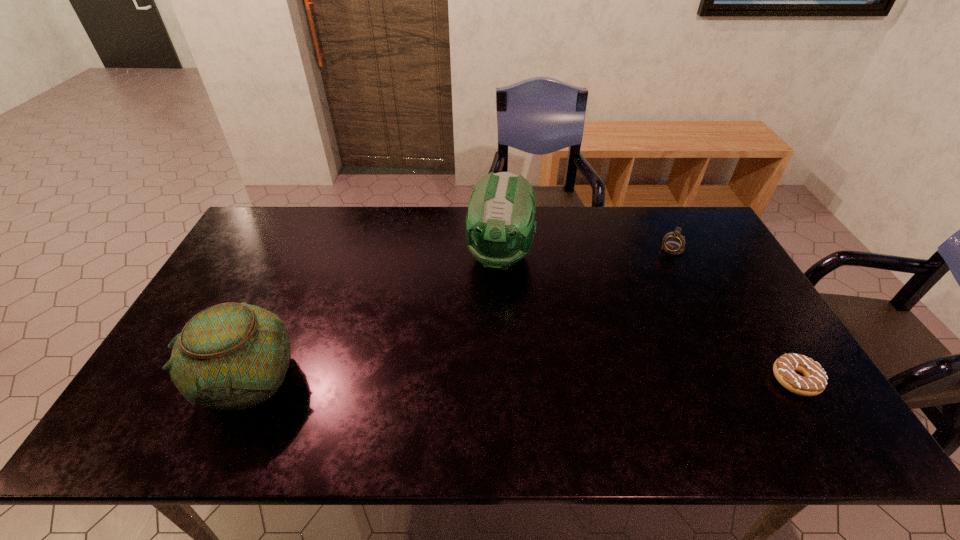
The height and width of the screenshot is (540, 960). In order to click on object that is at the left edge in this screenshot , I will do (x=231, y=356).

You are a GUI agent. You are given a task and a screenshot of the screen. Output one action in this format:
    pyautogui.click(x=<x>, y=<y>)
    Task: Click on the doughnut at the right edge
    The width and height of the screenshot is (960, 540).
    Given the screenshot: What is the action you would take?
    pyautogui.click(x=814, y=382)

Locate an element on the screen. compass positioned at the right edge is located at coordinates (673, 243).

The height and width of the screenshot is (540, 960). Find the location of `object located at the near left corner`. object located at the near left corner is located at coordinates (231, 356).

Locate an element on the screen. This screenshot has width=960, height=540. object that is at the far right corner is located at coordinates (673, 243).

The width and height of the screenshot is (960, 540). I want to click on object present at the near right corner, so [814, 382].

This screenshot has width=960, height=540. Identify the location of free location at the far edge. (646, 229).

In the image, there is a desktop. Identify the location of vacant space at the near edge. point(341,392).

The height and width of the screenshot is (540, 960). In the image, there is a desktop. In order to click on blank space at the right edge in this screenshot , I will do `click(705, 265)`.

Find the location of a particular element. The height and width of the screenshot is (540, 960). vacant space at the far left corner of the desktop is located at coordinates (252, 247).